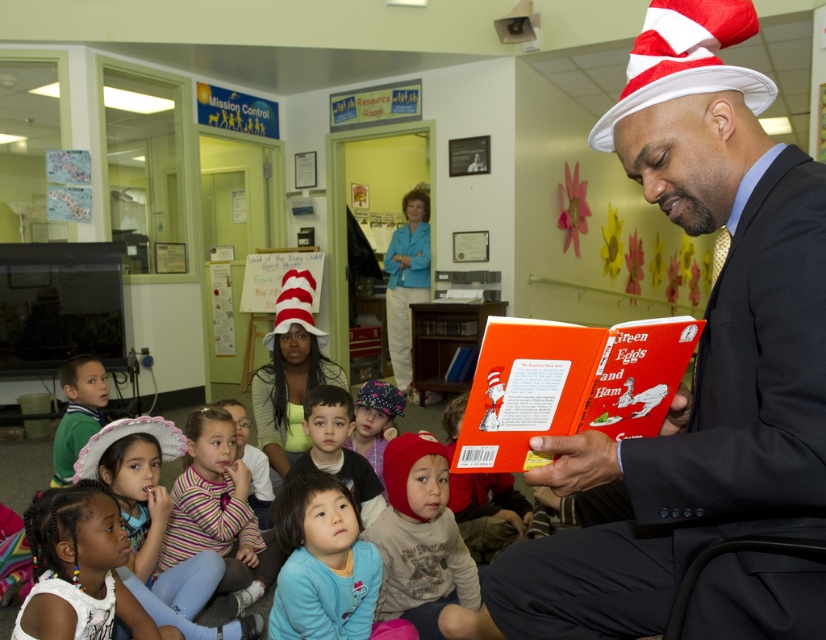
You are standing in the classroom and want to find the smooth skin girl at lower left. According to the coordinates given, where should you look to find her?

The smooth skin girl at lower left is located at point (79, 570), so you should look towards the lower left area of the image to find her.

You are a photographer standing in the corner of the room. You want to take a picture of the smooth skin girl at lower left and the green cotton shirt at lower left. How far apart should you position them in your photo?

The smooth skin girl at lower left and the green cotton shirt at lower left are 4.92 feet apart, so you should position them 4.92 feet apart in your photo.